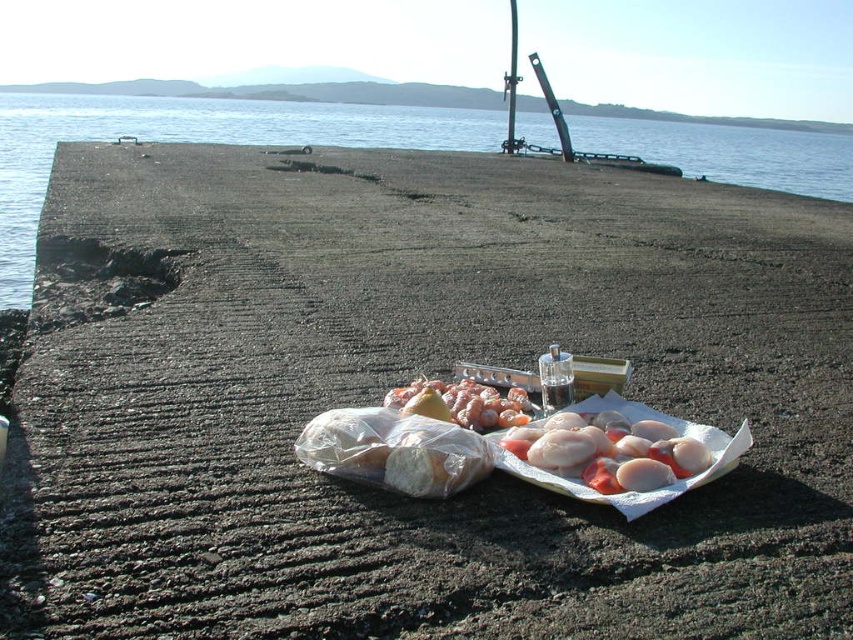
Does translucent plastic bag of grapes at center have a greater height compared to clear glass bottle at center?

In fact, translucent plastic bag of grapes at center may be shorter than clear glass bottle at center.

What do you see at coordinates (465, 403) in the screenshot? The image size is (853, 640). I see `translucent plastic bag of grapes at center` at bounding box center [465, 403].

Locate an element on the screen. This screenshot has height=640, width=853. translucent plastic bag of grapes at center is located at coordinates (465, 403).

Is point (630, 488) farther from viewer compared to point (494, 394)?

No, (630, 488) is in front of (494, 394).

Does point (570, 465) come closer to viewer compared to point (518, 404)?

Yes, point (570, 465) is closer to viewer.

Does point (525, 445) come closer to viewer compared to point (477, 401)?

That is True.

Locate an element on the screen. pinkish translucent scallops at center is located at coordinates (608, 451).

Who is shorter, transparent water at center or pinkish translucent scallops at center?

pinkish translucent scallops at center

Between point (584, 134) and point (560, 420), which one is positioned in front?

Point (560, 420) is more forward.

I want to click on transparent water at center, so click(190, 141).